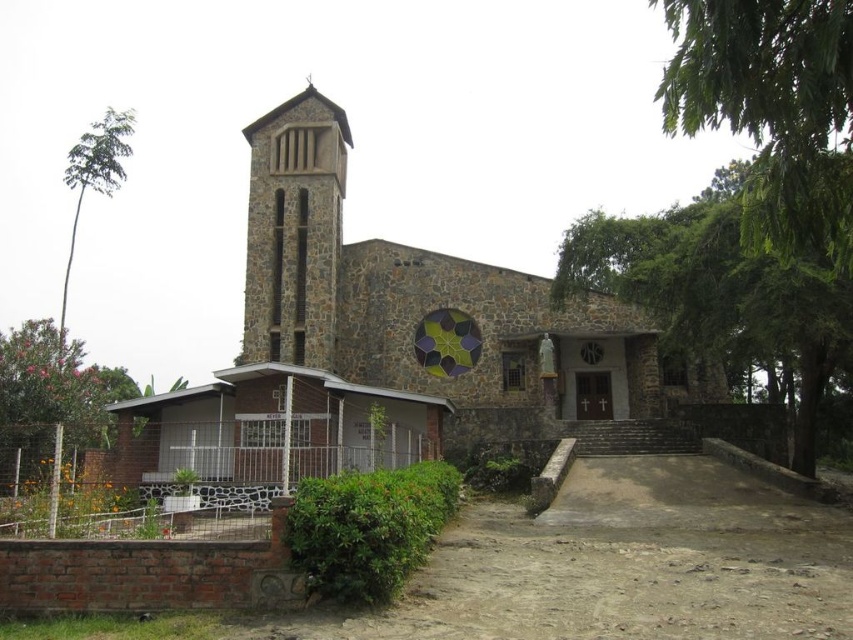
Question: Which of the following is the closest to the observer?

Choices:
 (A) (120, 138)
 (B) (328, 218)

Answer: (B)

Question: Can you confirm if brown stone church at center is bigger than green leafy tree at upper right?

Choices:
 (A) no
 (B) yes

Answer: (A)

Question: Does green leafy tree at lower left have a greater width compared to green leafy tree at left?

Choices:
 (A) no
 (B) yes

Answer: (B)

Question: Can you confirm if green leafy tree at upper right is positioned to the left of green leafy tree at lower left?

Choices:
 (A) no
 (B) yes

Answer: (A)

Question: Which point appears farthest from the camera in this image?

Choices:
 (A) (315, 248)
 (B) (680, 68)
 (C) (114, 134)
 (D) (16, 429)

Answer: (C)

Question: Based on their relative distances, which object is nearer to the green leafy tree at left?

Choices:
 (A) brown stone bell tower at left
 (B) green leafy tree at upper right

Answer: (A)